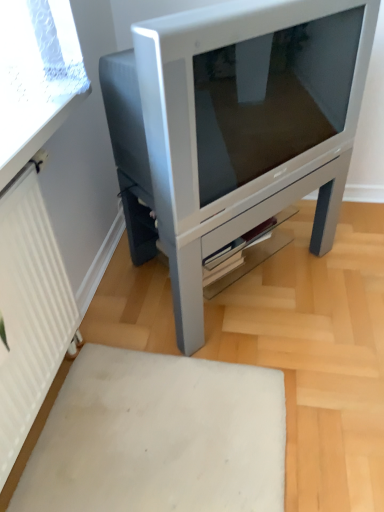
Find the location of `vacant space underneath white ribbed radiator at left (from a real-world perspective)`. vacant space underneath white ribbed radiator at left (from a real-world perspective) is located at coordinates (60, 392).